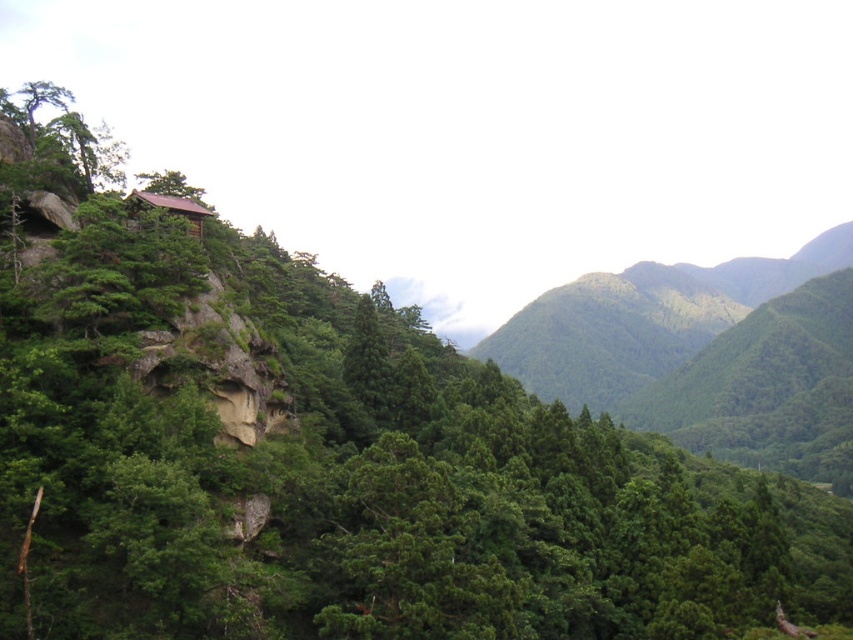
Based on the scene description, which object occupies a larger area in the image? Please choose between the green leafy forest at center and the brown wooden hut at upper left.

The green leafy forest at center is bigger than the brown wooden hut at upper left, so the green leafy forest at center occupies a larger area in the image.

You are planning to build a hiking trail that must pass between the green leafy forest at center and the brown wooden hut at upper left. The trail needs to be wide enough for two hikers to walk side by side. Given that the average width required for two hikers is 2 meters, can the space between these two objects accommodate the trail?

The green leafy forest at center is wider than the brown wooden hut at upper left. However, the exact width of the space between them isn

You are a hiker trying to navigate through the mountain landscape. You see the green leafy forest at center. Based on the coordinates provided, can you determine if the forest is positioned closer to the top or bottom of the image?

The green leafy forest at center is located at point (705, 353), where the y coordinate 0.828 indicates it is closer to the bottom of the image since lower y values are at the top and higher y values are at the bottom.